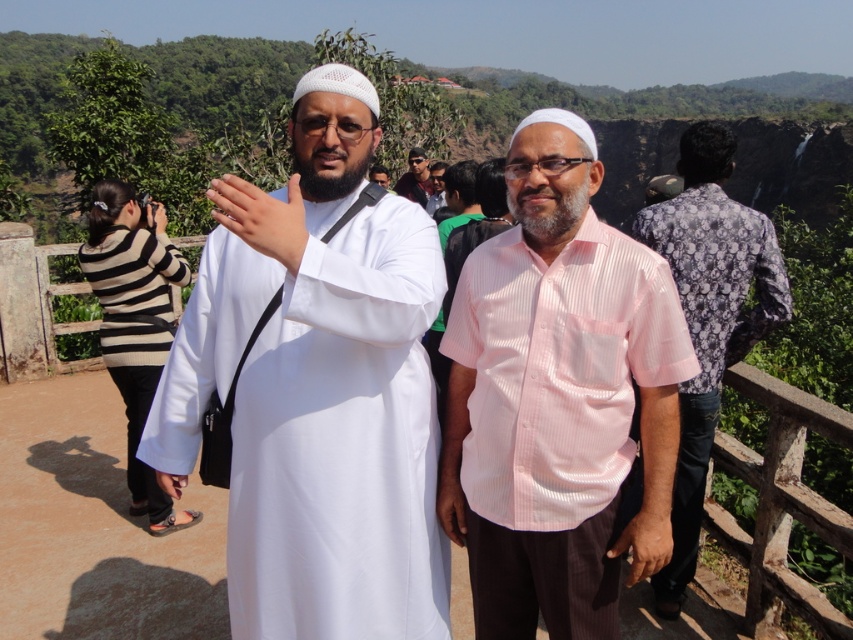
You are a photographer trying to capture a closeup shot of the matte black sunglasses at center and the matte white hand at center. Which object should you focus on first to ensure it appears sharp in your photo?

You should focus on the matte black sunglasses at center first because it is closer to the viewer than the matte white hand at center, so focusing on it will keep it sharp while the hand may appear slightly out of focus if the depth of field is limited.

You are a photographer trying to capture a photo of the two men at the scenic spot. You want to ensure that the light pink shirt at center and the matte white hand at center are both in the frame. Based on their positions, which object should you focus on first to ensure both are in the frame?

The light pink shirt at center is to the right of the matte white hand at center, so focusing on the matte white hand at center first will allow the light pink shirt at center to naturally fall into the frame to its right.